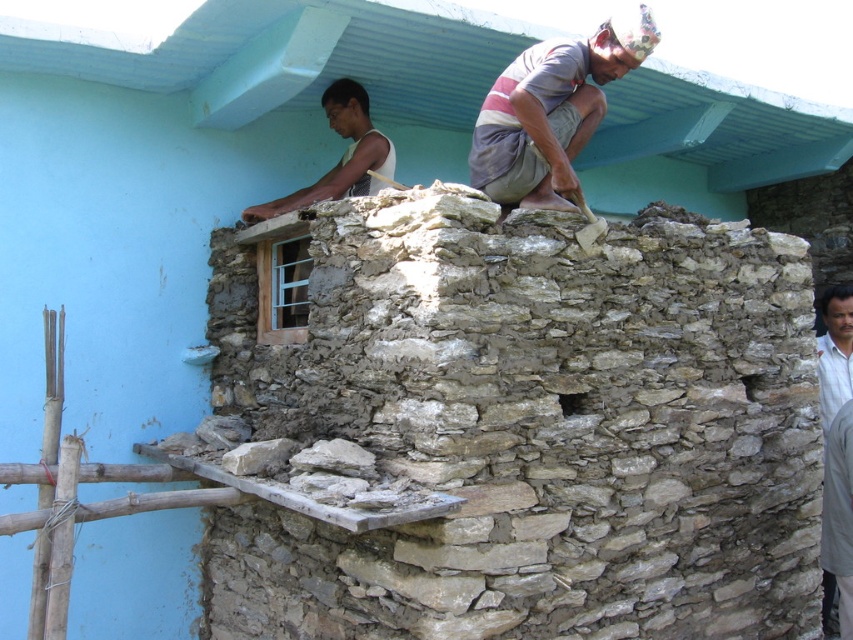
The height and width of the screenshot is (640, 853). What do you see at coordinates (550, 113) in the screenshot? I see `striped fabric headband at upper center` at bounding box center [550, 113].

Can you confirm if striped fabric headband at upper center is positioned above white matte shirt at upper center?

Yes, striped fabric headband at upper center is above white matte shirt at upper center.

Describe the element at coordinates (550, 113) in the screenshot. The width and height of the screenshot is (853, 640). I see `striped fabric headband at upper center` at that location.

Where is `striped fabric headband at upper center`? This screenshot has height=640, width=853. striped fabric headband at upper center is located at coordinates (550, 113).

Who is higher up, natural stone wall at upper center or light brown textured shirt at right?

light brown textured shirt at right is above.

Does natural stone wall at upper center have a greater width compared to light brown textured shirt at right?

Yes.

Is point (308, 627) closer to viewer compared to point (834, 376)?

Yes, point (308, 627) is closer to viewer.

The image size is (853, 640). I want to click on natural stone wall at upper center, so click(x=531, y=428).

Is natural stone wall at upper center closer to the viewer compared to white matte shirt at upper center?

Yes.

Between natural stone wall at upper center and white matte shirt at upper center, which one has more height?

natural stone wall at upper center

Image resolution: width=853 pixels, height=640 pixels. Identify the location of natural stone wall at upper center. (531, 428).